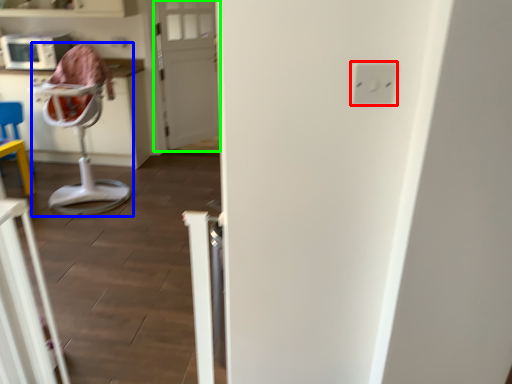
Question: Based on their relative distances, which object is farther from electric outlet (highlighted by a red box)? Choose from feeding chair (highlighted by a blue box) and door (highlighted by a green box).

Choices:
 (A) feeding chair
 (B) door

Answer: (B)